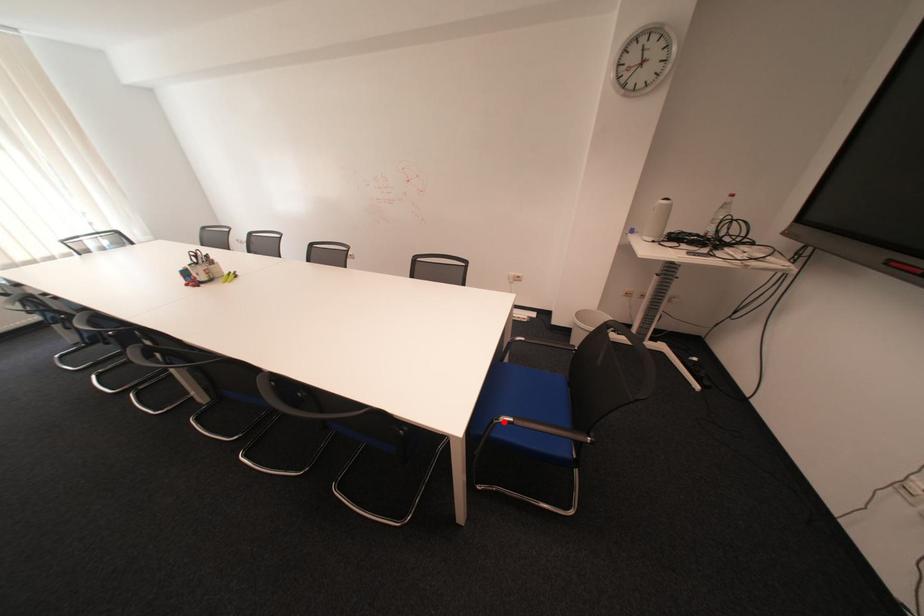
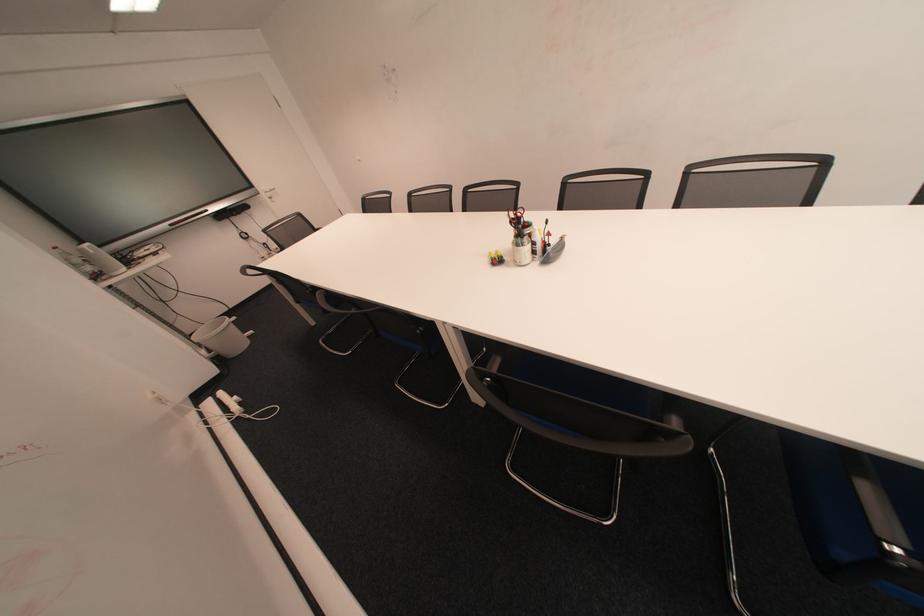
Question: I am providing you with two images of the same scene from different viewpoints. A red point is marked on the first image. Is the red point's position out of view in image 2?

Choices:
 (A) Yes
 (B) No

Answer: (A)